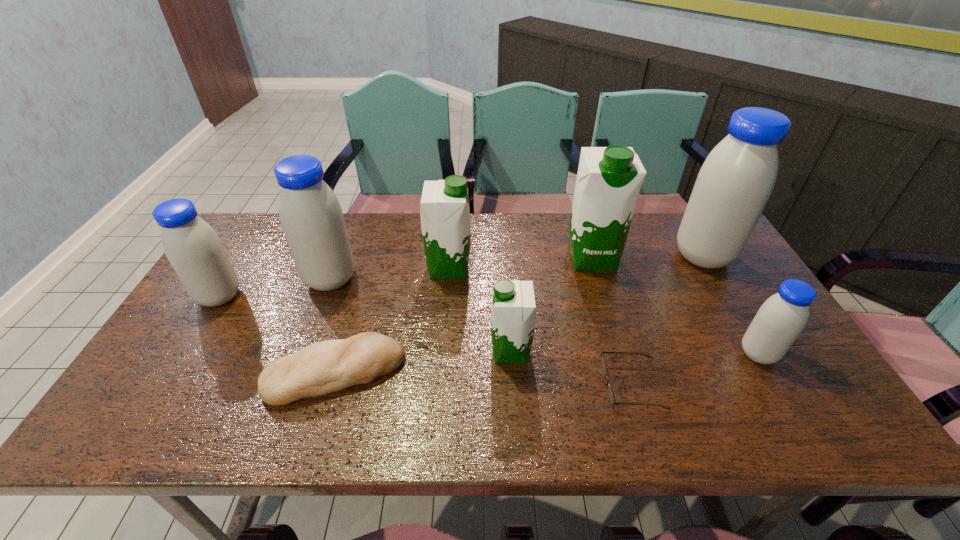
Image resolution: width=960 pixels, height=540 pixels. I want to click on the nearest green soya milk, so click(513, 314).

You are a GUI agent. You are given a task and a screenshot of the screen. Output one action in this format:
    pyautogui.click(x=<x>, y=<y>)
    Task: Click on the smallest green soya milk
    The width and height of the screenshot is (960, 540).
    Given the screenshot: What is the action you would take?
    pyautogui.click(x=513, y=314)

Locate an element on the screen. This screenshot has width=960, height=540. the nearest blue soya milk is located at coordinates (782, 317).

Find the location of `the eighth tallest object`. the eighth tallest object is located at coordinates (321, 368).

Image resolution: width=960 pixels, height=540 pixels. In order to click on bread in this screenshot , I will do `click(321, 368)`.

At what (x,y) coordinates should I click in order to perform the action: click on spectacles. Please return your answer as a coordinate pair (x, y). Looking at the image, I should click on click(603, 363).

Identify the location of vacant area located 0.270m on the left of the tallest object. (588, 256).

Locate an element on the screen. free location located on the front-facing side of the biggest green soya milk is located at coordinates coord(630,386).

Locate an element on the screen. The width and height of the screenshot is (960, 540). vacant area situated 0.260m on the left of the third smallest blue soya milk is located at coordinates (216, 279).

Where is `free region located on the front-facing side of the leftmost green soya milk`? This screenshot has height=540, width=960. free region located on the front-facing side of the leftmost green soya milk is located at coordinates (493, 268).